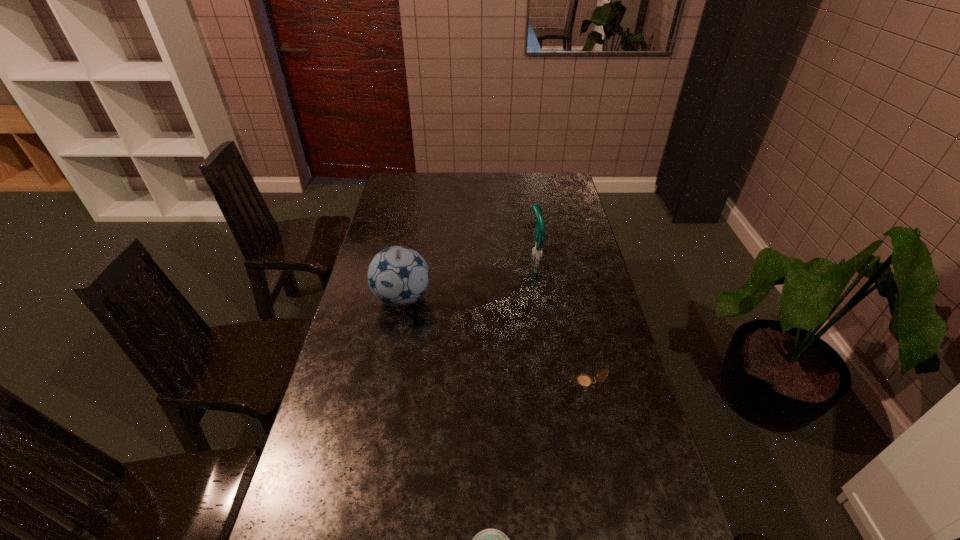
Where is `blank space located 0.380m on the face of the second nearest object`? blank space located 0.380m on the face of the second nearest object is located at coordinates (438, 382).

The width and height of the screenshot is (960, 540). Find the location of `vacant area located on the face of the second nearest object`. vacant area located on the face of the second nearest object is located at coordinates (507, 382).

Image resolution: width=960 pixels, height=540 pixels. Find the location of `free space located on the face of the second nearest object`. free space located on the face of the second nearest object is located at coordinates (520, 382).

This screenshot has height=540, width=960. I want to click on object that is at the left edge, so click(x=398, y=276).

At what (x,y) coordinates should I click in order to perform the action: click on object at the right edge. Please return your answer as a coordinate pair (x, y). Looking at the image, I should click on (585, 381).

In the image, there is a desktop. Identify the location of vacant space at the far edge. (470, 194).

The image size is (960, 540). In order to click on free region at the left edge in this screenshot , I will do `click(341, 398)`.

At what (x,y) coordinates should I click in order to perform the action: click on vacant region at the right edge of the desktop. Please return your answer as a coordinate pair (x, y). Looking at the image, I should click on (559, 257).

The image size is (960, 540). I want to click on vacant area at the far left corner, so click(x=403, y=174).

Find the location of `vacant area at the far right corner of the desktop`. vacant area at the far right corner of the desktop is located at coordinates (543, 177).